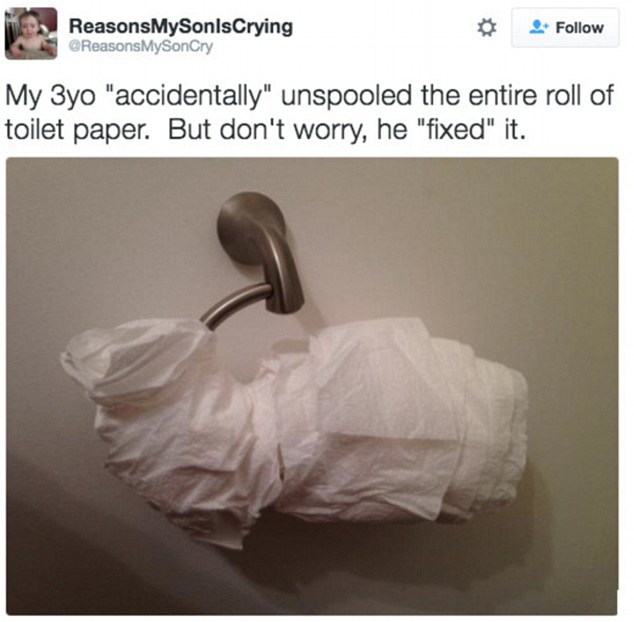
Find the location of a particular element. The image size is (634, 622). baby picture is located at coordinates (23, 40).